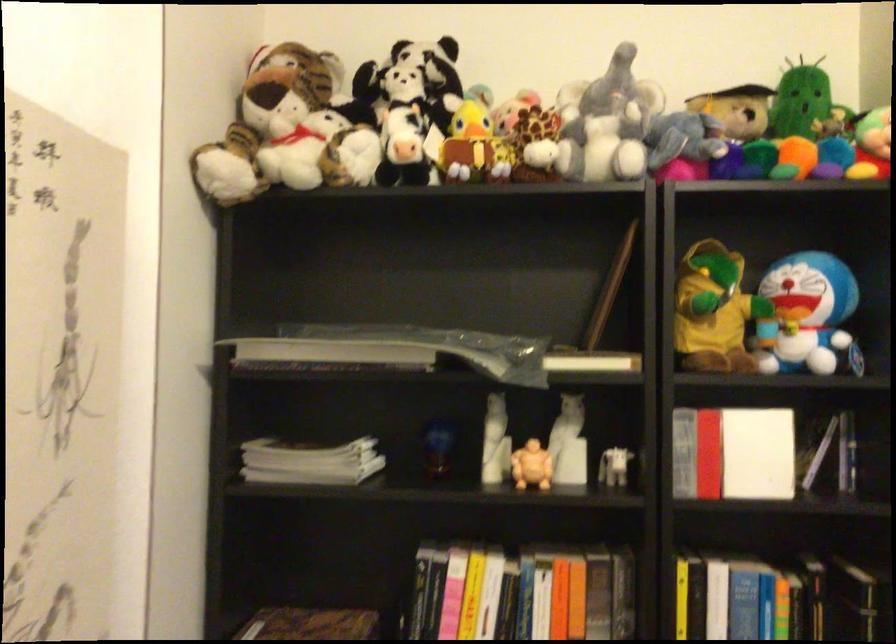
The image size is (896, 644). What are the coordinates of `stuffed duck toy` in the screenshot? It's located at (475, 146).